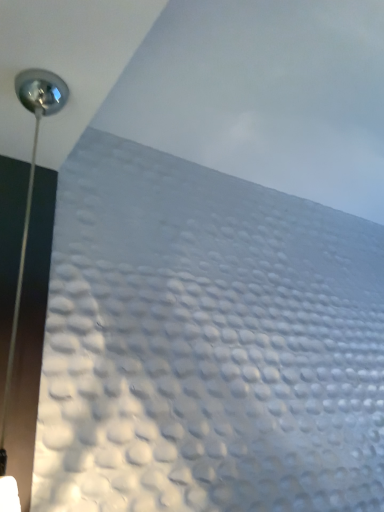
Locate an element on the screen. This screenshot has height=512, width=384. satin silver lamp at upper left is located at coordinates (25, 280).

Measure the distance between point (1, 328) and camera.

Point (1, 328) is 33.62 inches away from camera.

Measure the distance between satin silver lamp at upper left and camera.

satin silver lamp at upper left and camera are 28.08 inches apart.

In order to face satin silver lamp at upper left, should I rotate leftwards or rightwards?

Turn left by 21.023 degrees to look at satin silver lamp at upper left.

What do you see at coordinates (25, 280) in the screenshot? The height and width of the screenshot is (512, 384). I see `satin silver lamp at upper left` at bounding box center [25, 280].

Locate an element on the screen. Image resolution: width=384 pixels, height=512 pixels. satin silver lamp at upper left is located at coordinates (25, 280).